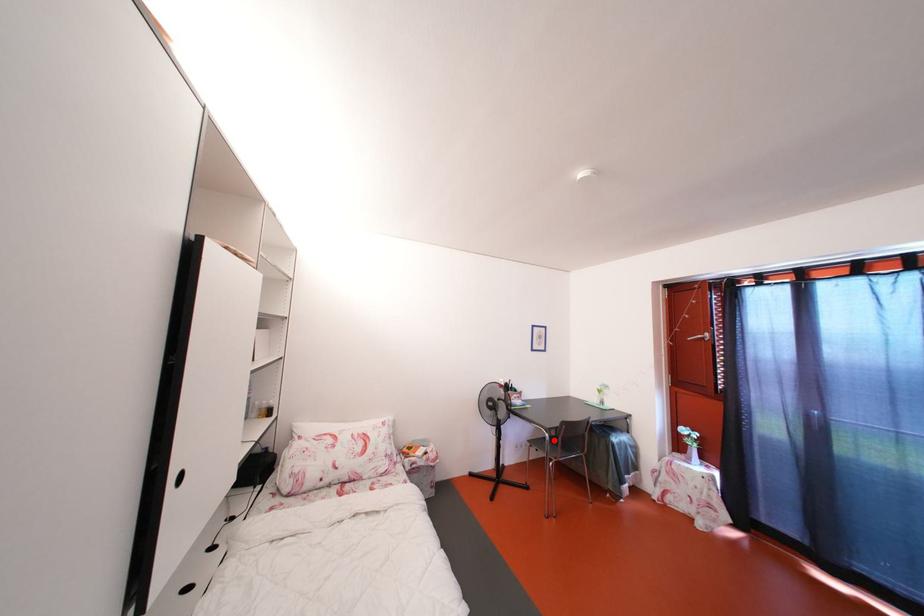
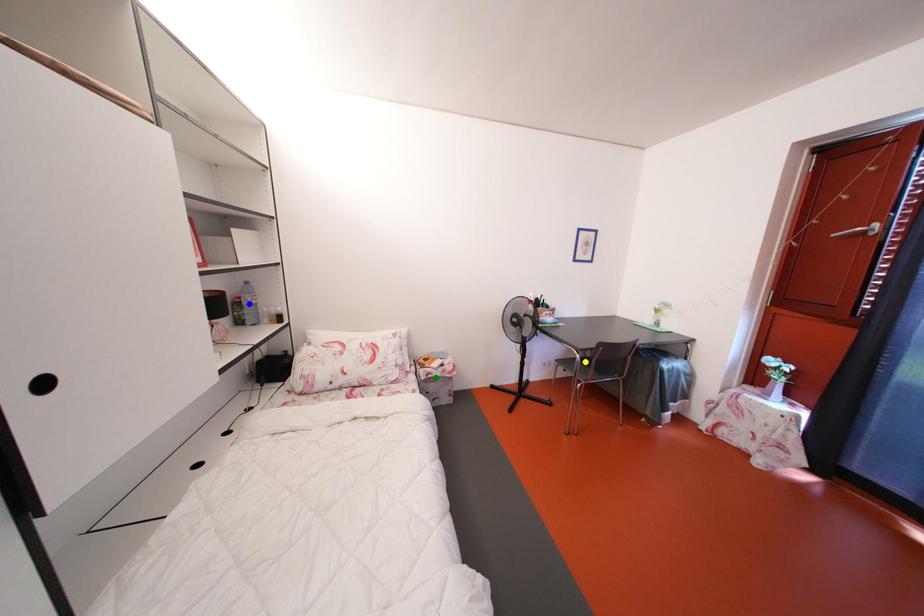
Question: I am providing you with two images of the same scene from different viewpoints. A red point is marked on the first image. You are given multiple points on the second image. Can you choose the point in image 2 that corresponds to the point in image 1?

Choices:
 (A) blue point
 (B) yellow point
 (C) green point

Answer: (B)